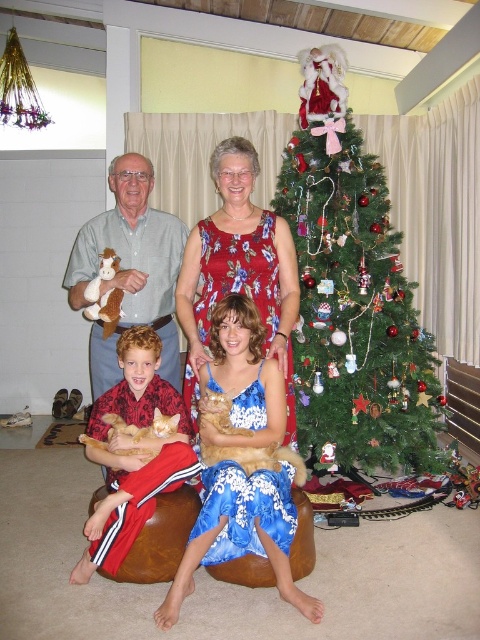
In the scene shown: You are a photographer setting up for a family photo. You want to ensure that both the green textured christmas tree at center and the floral fabric dress at center are visible in the frame. Based on their positions, which object is closer to the camera?

The green textured christmas tree at center is closer to the camera because the floral fabric dress at center is behind it.

You are standing in the room and want to hang an ornament on the green textured christmas tree at center. If your maximum reach is 2 meters, can you reach the tree without any assistance?

The green textured christmas tree at center is 3.25 meters away from the viewer. Since your maximum reach is 2 meters, you cannot reach the tree without assistance.

You are a photographer setting up a camera at the back of the room. You need to ensure both the floral fabric dress at center and the orange fur cat at lower left are visible in the frame. Which object is taller and might require adjusting the camera angle to capture fully?

The floral fabric dress at center is taller than the orange fur cat at lower left, so you may need to adjust the camera angle to ensure the entire dress is visible.